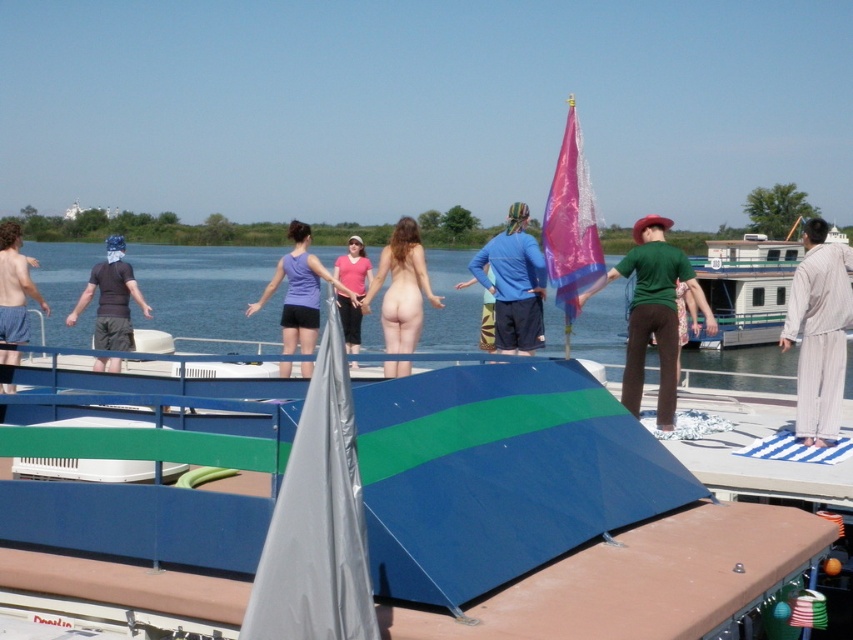
Question: Considering the real-world distances, which object is farthest from the light beige robe at right?

Choices:
 (A) green matte shirt at center
 (B) matte blue shorts at left

Answer: (B)

Question: Which of the following is the closest to the observer?

Choices:
 (A) (529, 241)
 (B) (436, 304)
 (C) (799, 428)
 (D) (660, 349)

Answer: (C)

Question: Which point is closer to the camera?

Choices:
 (A) (306, 317)
 (B) (821, 221)
 (C) (654, 333)

Answer: (C)

Question: Is green matte shirt at center below nude skin at center?

Choices:
 (A) yes
 (B) no

Answer: (A)

Question: Does transparent water at center have a lesser width compared to purple fabric tank top at center?

Choices:
 (A) yes
 (B) no

Answer: (B)

Question: Is light beige robe at right positioned at the back of dark gray t-shirt at left?

Choices:
 (A) yes
 (B) no

Answer: (B)